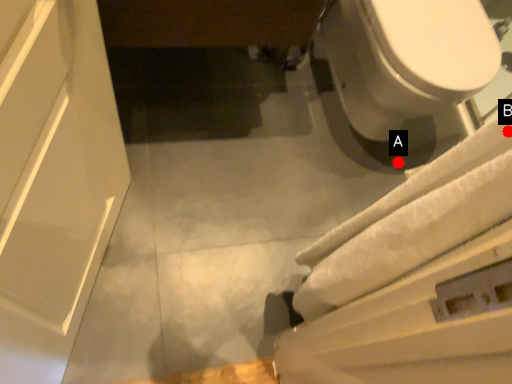
Question: Two points are circled on the image, labeled by A and B beside each circle. Which of the following is the closest to the observer?

Choices:
 (A) A is closer
 (B) B is closer

Answer: (B)